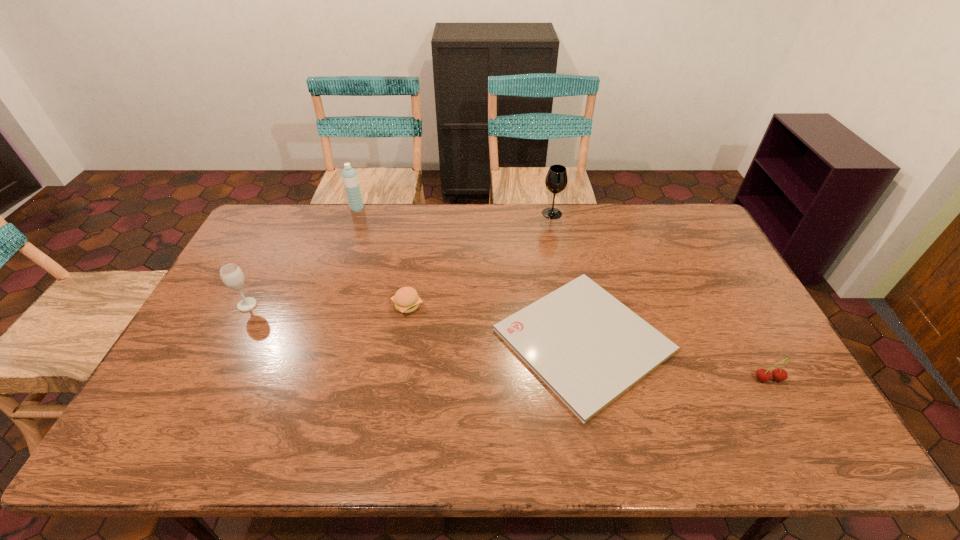
The width and height of the screenshot is (960, 540). Find the location of `object located in the right edge section of the desktop`. object located in the right edge section of the desktop is located at coordinates (763, 375).

Locate an element on the screen. The width and height of the screenshot is (960, 540). free space at the far edge of the desktop is located at coordinates (384, 242).

At what (x,y) coordinates should I click in order to perform the action: click on free space at the near edge of the desktop. Please return your answer as a coordinate pair (x, y). The width and height of the screenshot is (960, 540). Looking at the image, I should click on (744, 444).

Identify the location of free space at the left edge of the desktop. Image resolution: width=960 pixels, height=540 pixels. (208, 361).

Identify the location of free space at the right edge of the desktop. The width and height of the screenshot is (960, 540). (684, 274).

Locate an element on the screen. The height and width of the screenshot is (540, 960). free space that is in between the water bottle and the farther wineglass is located at coordinates (455, 211).

You are a GUI agent. You are given a task and a screenshot of the screen. Output one action in this format:
    pyautogui.click(x=<x>, y=<y>)
    Task: Click on the empty location between the shortest object and the left wineglass
    This screenshot has height=540, width=960.
    Given the screenshot: What is the action you would take?
    point(416,322)

Identify the location of unoccupied position between the shortest object and the water bottle. The height and width of the screenshot is (540, 960). (470, 274).

At what (x,y) coordinates should I click in order to perform the action: click on vacant area that lies between the shortest object and the nearer wineglass. Please return your answer as a coordinate pair (x, y). Looking at the image, I should click on (416, 322).

At what (x,y) coordinates should I click in order to perform the action: click on vacant point located between the farther wineglass and the hamburger. Please return your answer as a coordinate pair (x, y). The width and height of the screenshot is (960, 540). Looking at the image, I should click on pos(480,260).